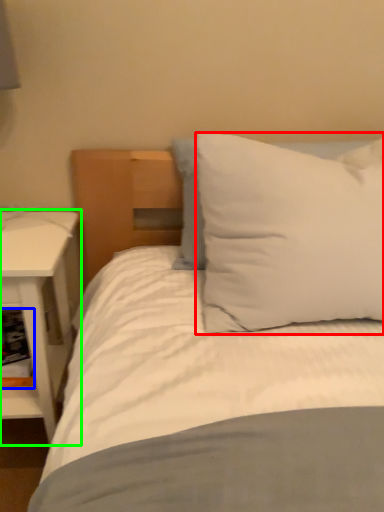
Question: Which is nearer to the pillow (highlighted by a red box)? shelf (highlighted by a blue box) or nightstand (highlighted by a green box).

Choices:
 (A) shelf
 (B) nightstand

Answer: (B)